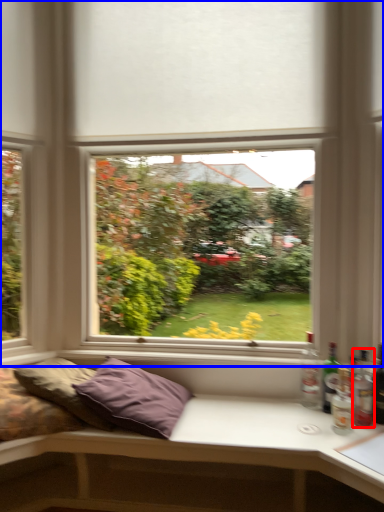
Question: Which object is closer to the camera taking this photo, bottle (highlighted by a red box) or window (highlighted by a blue box)?

Choices:
 (A) bottle
 (B) window

Answer: (A)